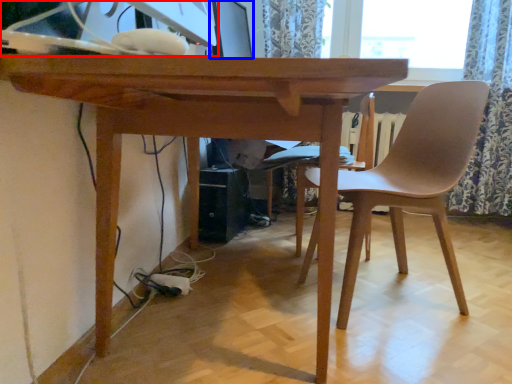
Question: Which object is closer to the camera taking this photo, desktop computer (highlighted by a red box) or computer monitor (highlighted by a blue box)?

Choices:
 (A) desktop computer
 (B) computer monitor

Answer: (A)